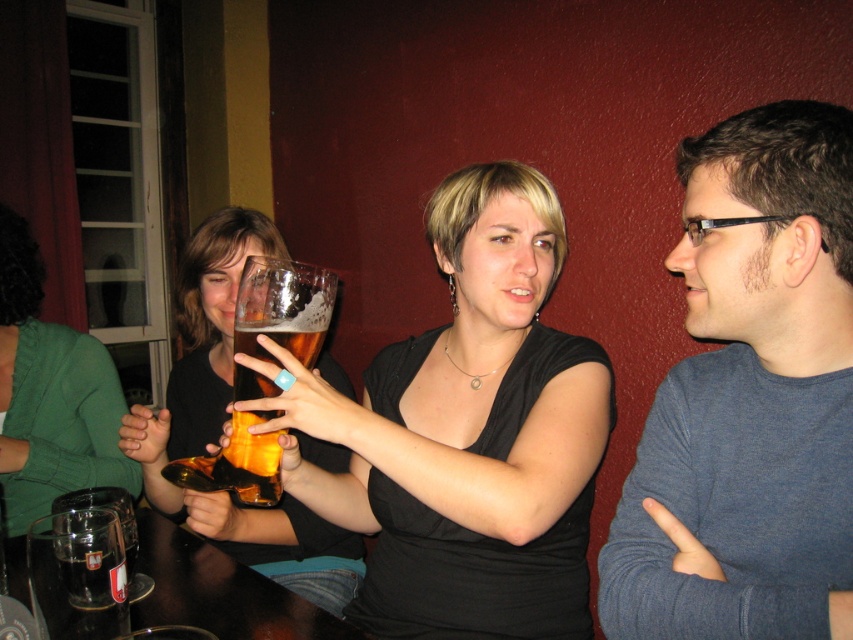
You are at a bar and want to order a drink. You see a translucent glass mug at center and a green fabric shirt at left. Which object is larger in size?

The translucent glass mug at center is bigger than the green fabric shirt at left.

You are a photographer taking a picture of the scene. You notice the matte black dress at center and the translucent glass mug at center. Which object will appear larger in your photo?

The matte black dress at center will appear larger in the photo because it is closer to the viewer than the translucent glass mug at center.